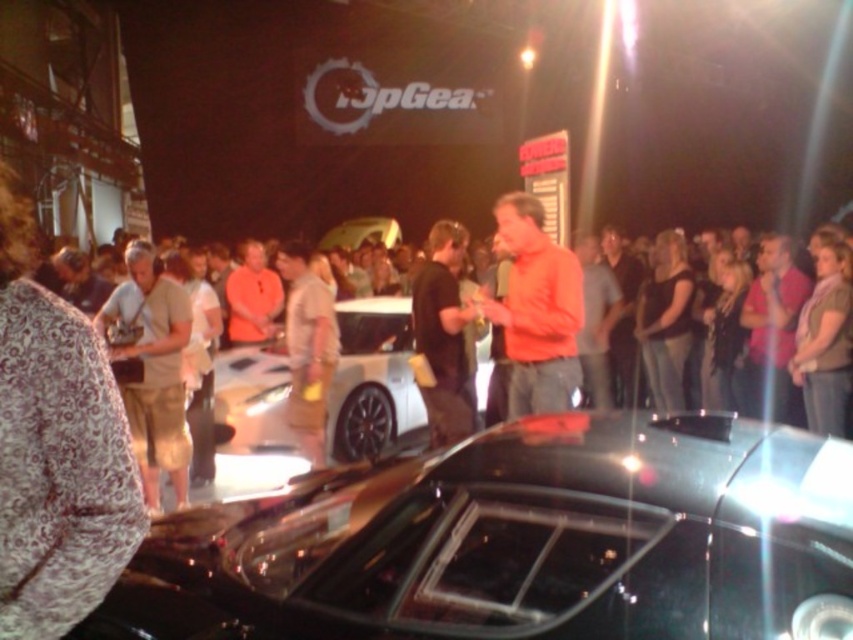
You are at a car show and see two attendees wearing a patterned fabric shirt at center and a black fabric dress at center. Which clothing item is positioned to the left?

The patterned fabric shirt at center is to the left of the black fabric dress at center.

You are standing at the entrance of the car exhibition and want to walk towards the black car in the foreground. There are two points marked as point 1 and point 2 on the floor. Point 1 is at coordinate (410, 413) and point 2 is at (531, 273). Which point should you step on first to reach the black car efficiently?

You should step on point 2 first because point 1 is behind point 2, so stepping on point 2 first will bring you closer to the black car in the foreground.